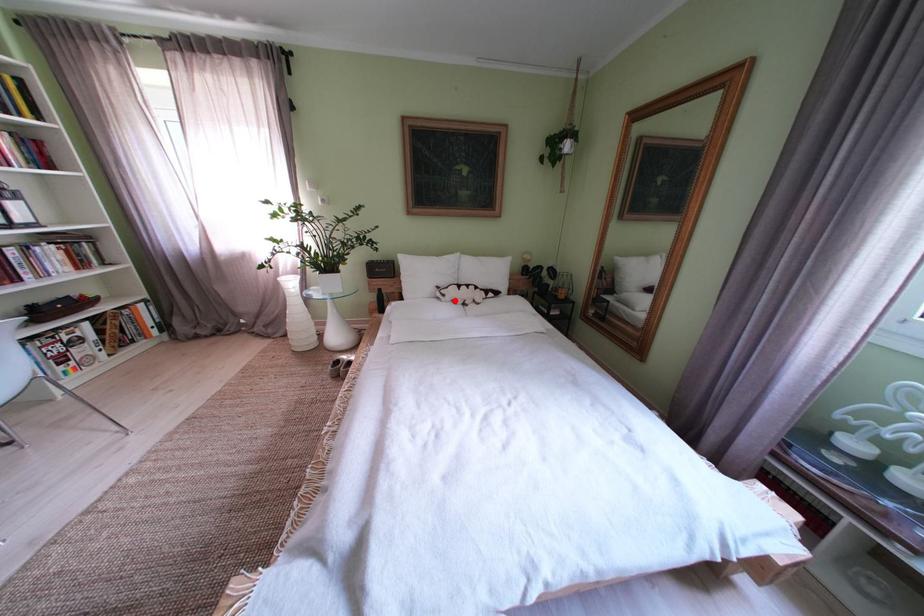
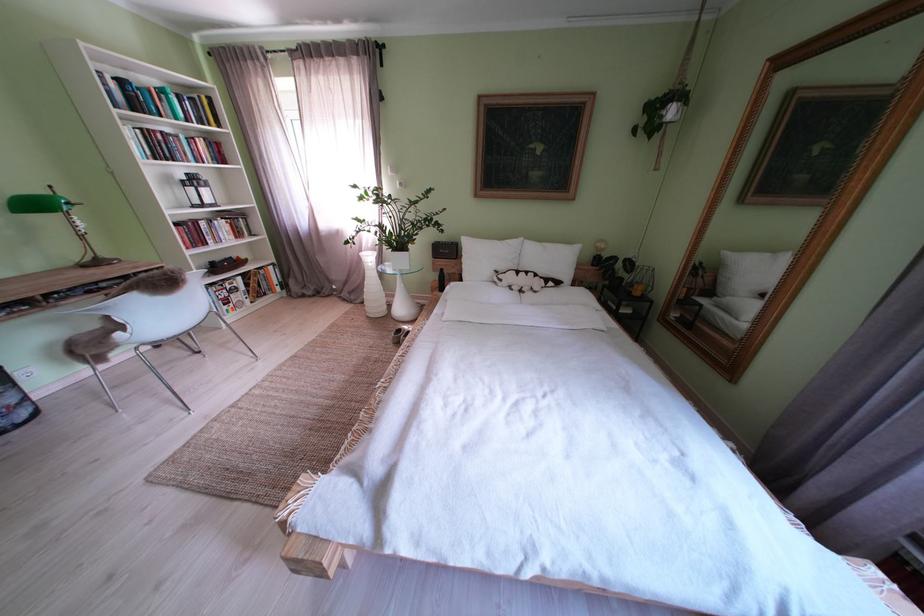
Locate, in the second image, the point that corresponds to the highlighted location in the first image.

(512, 285)